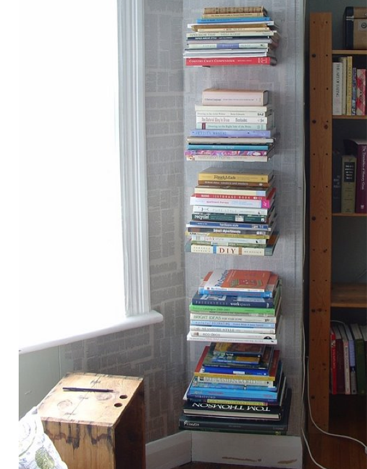
The height and width of the screenshot is (469, 367). I want to click on wooden bookshelf, so click(x=323, y=221).